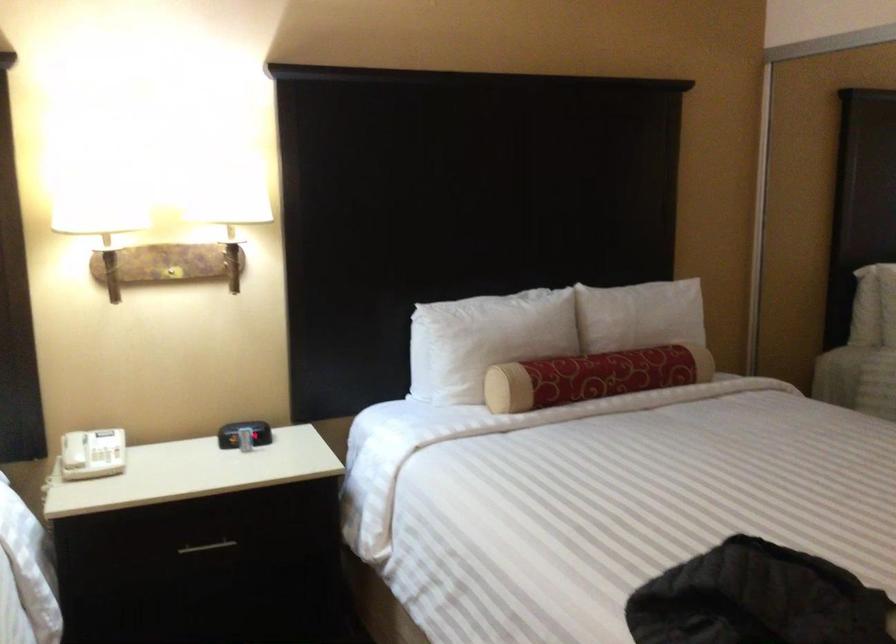
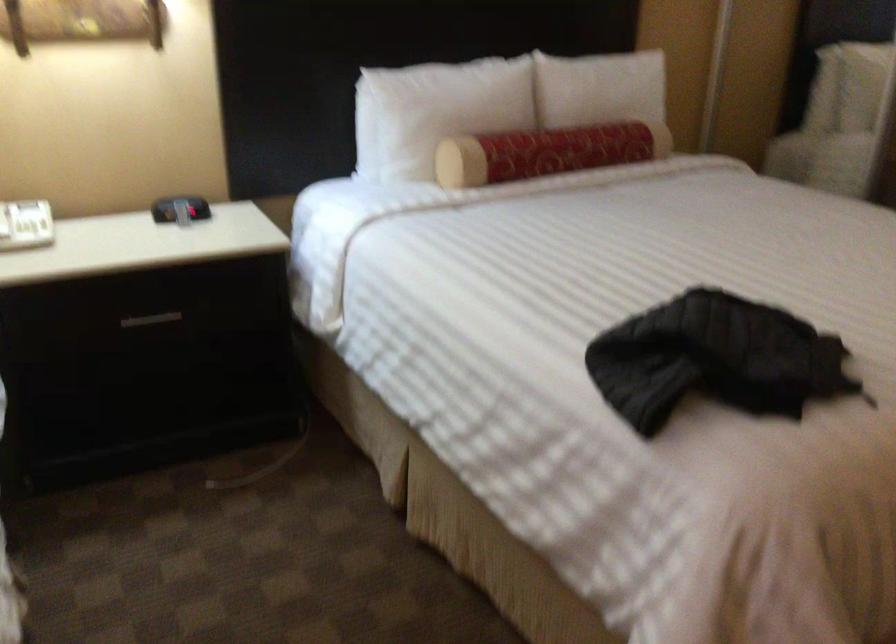
The point at (588, 377) is marked in the first image. Where is the corresponding point in the second image?

(546, 152)